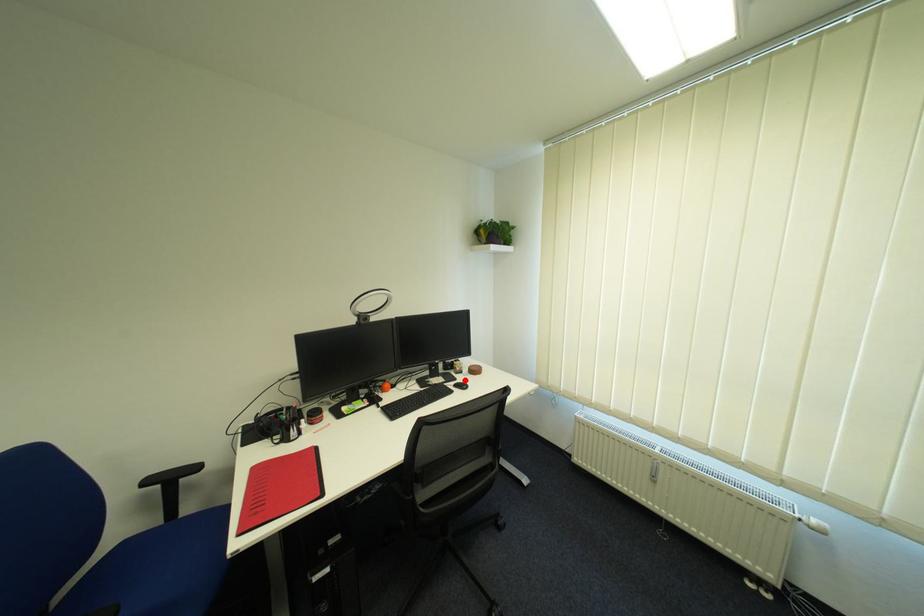
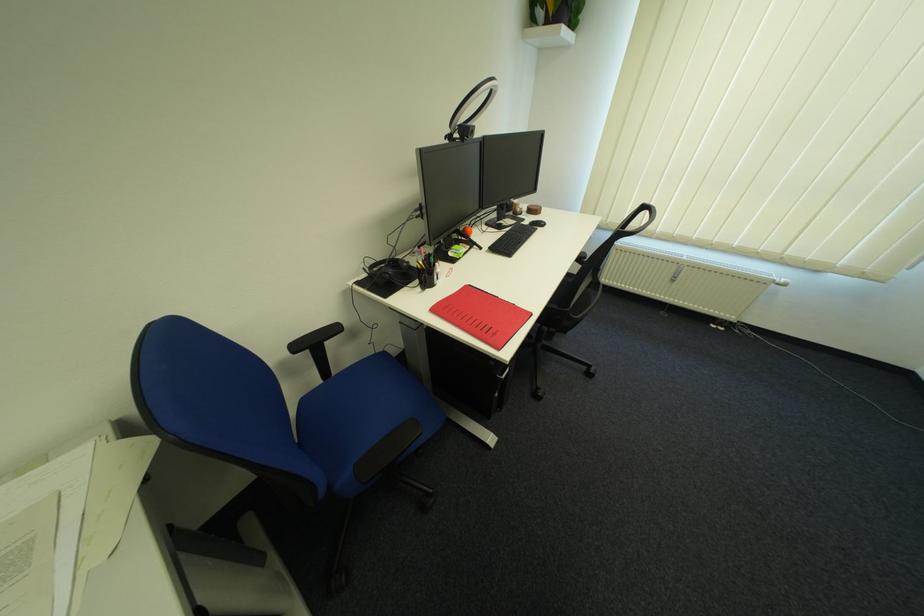
Find the pixel in the second image that matches the highlighted location in the first image.

(532, 221)